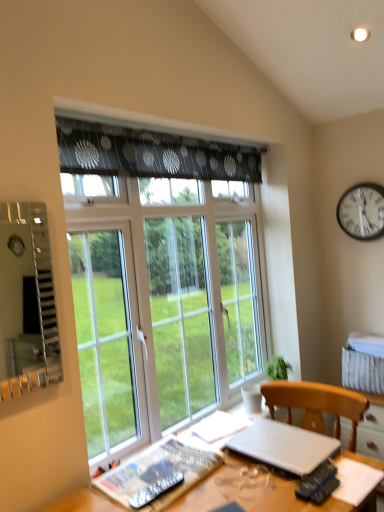
Identify the location of vacant space in front of silver metallic laptop at lower right. (273, 482).